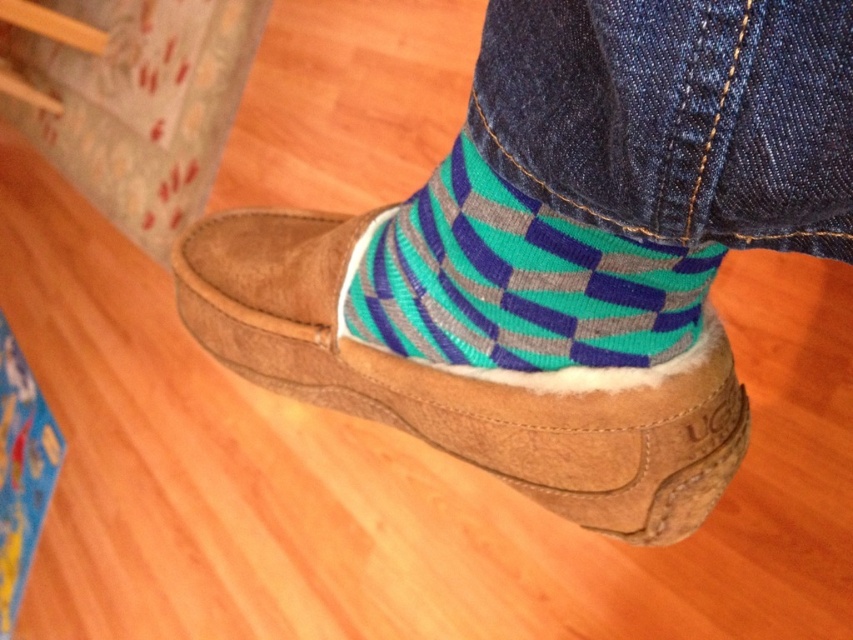
How much distance is there between suede slipper at center and teal/grey striped sock at lower center?

suede slipper at center and teal/grey striped sock at lower center are 8.33 centimeters apart.

Image resolution: width=853 pixels, height=640 pixels. I want to click on suede slipper at center, so coord(468,381).

Does dark blue denim jeans at lower center appear on the right side of teal/grey striped sock at lower center?

Correct, you'll find dark blue denim jeans at lower center to the right of teal/grey striped sock at lower center.

Can you confirm if dark blue denim jeans at lower center is taller than teal/grey striped sock at lower center?

No.

Is point (608, 116) farther from camera compared to point (432, 294)?

No.

The image size is (853, 640). In order to click on dark blue denim jeans at lower center in this screenshot , I will do `click(675, 116)`.

Who is higher up, dark blue denim jeans at lower center or suede slipper at center?

Positioned higher is dark blue denim jeans at lower center.

Does point (722, 216) come behind point (357, 374)?

No.

Identify the location of dark blue denim jeans at lower center. This screenshot has width=853, height=640. (675, 116).